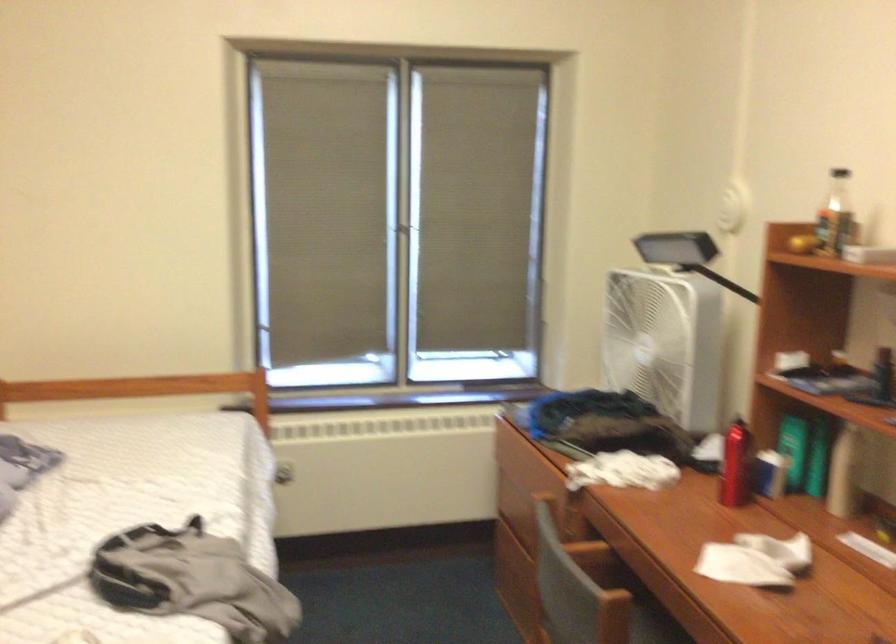
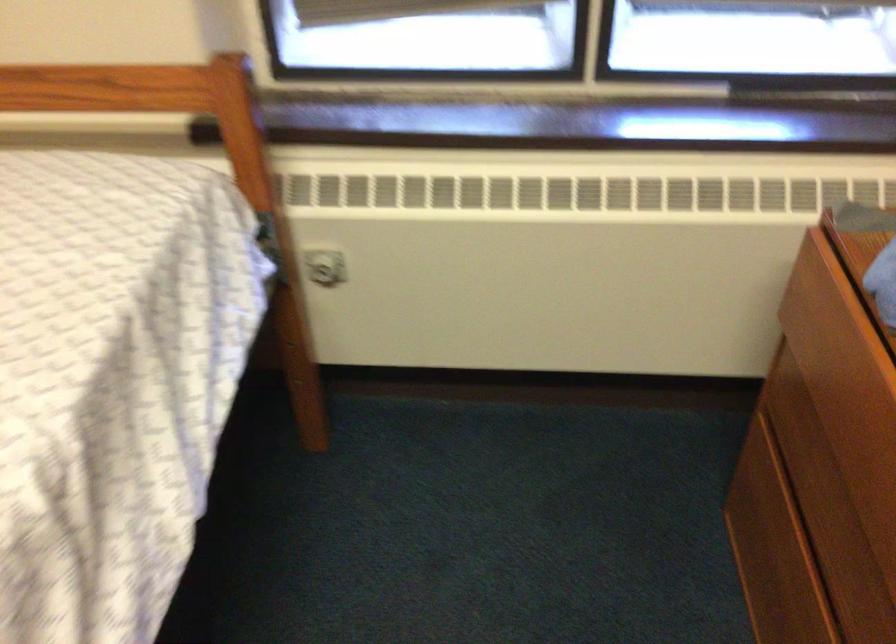
Find the pixel in the second image that matches pixel 282 469 in the first image.

(323, 267)